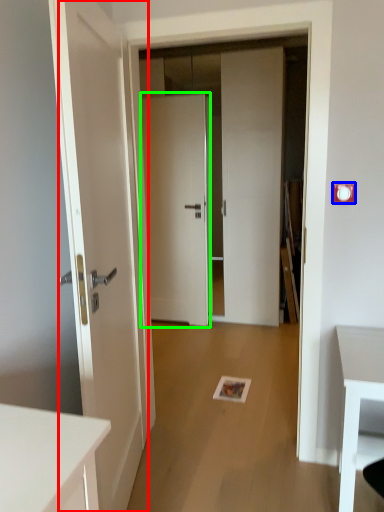
Question: Considering the real-world distances, which object is farthest from door (highlighted by a red box)? electric outlet (highlighted by a blue box) or door (highlighted by a green box)?

Choices:
 (A) electric outlet
 (B) door

Answer: (B)